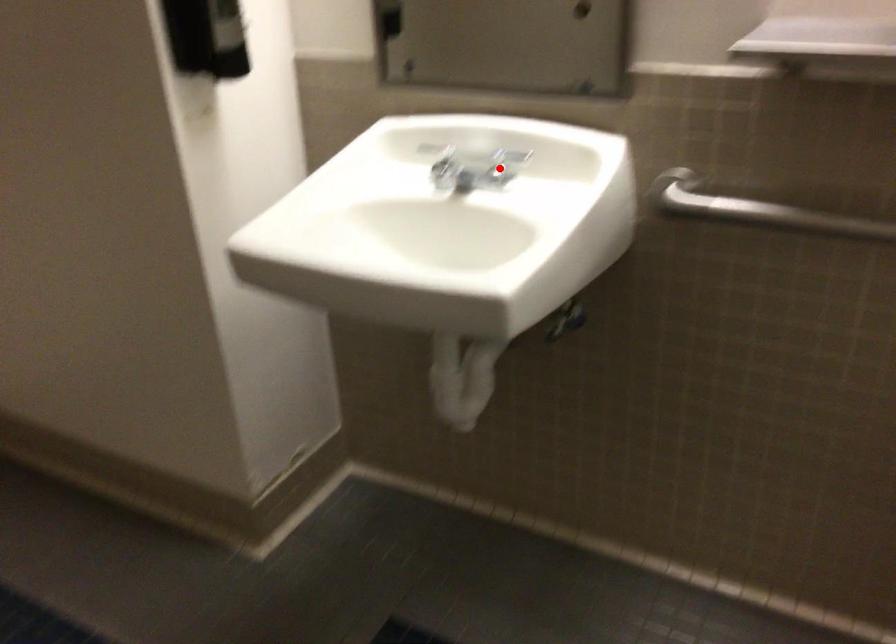
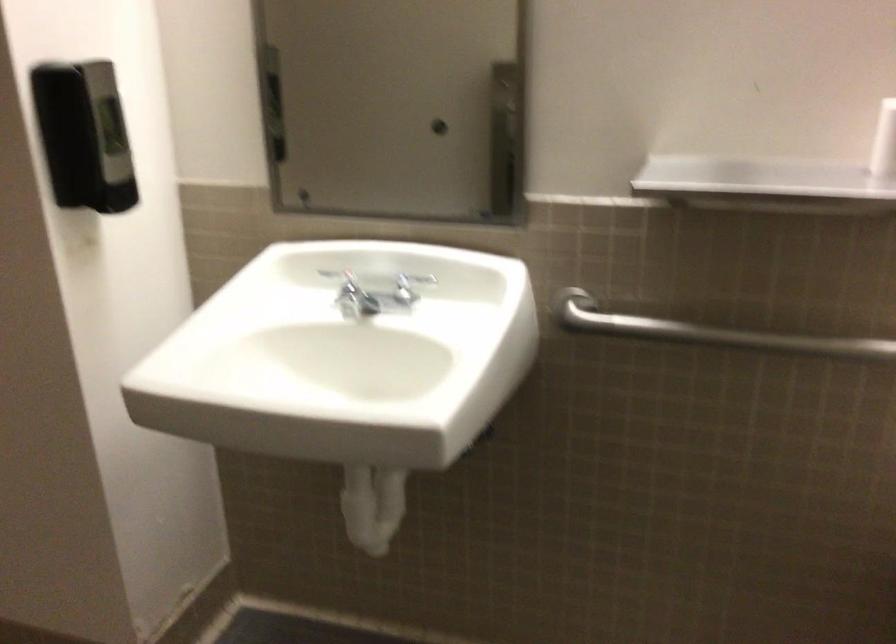
In the second image, find the point that corresponds to the highlighted location in the first image.

(403, 290)